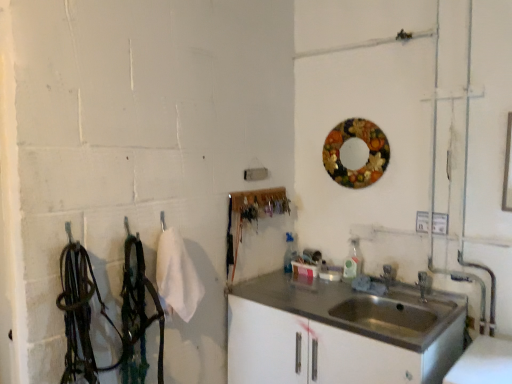
Question: Is point (371, 130) closer or farther from the camera than point (340, 347)?

Choices:
 (A) closer
 (B) farther

Answer: (B)

Question: Considering the positions of wooden circular mirror at upper right and satin white cabinet at lower right in the image, is wooden circular mirror at upper right taller or shorter than satin white cabinet at lower right?

Choices:
 (A) short
 (B) tall

Answer: (B)

Question: Estimate the real-world distances between objects in this image. Which object is closer to the satin silver faucet at sink right?

Choices:
 (A) satin white cabinet at lower right
 (B) wooden circular mirror at upper right

Answer: (A)

Question: Which object is positioned farthest from the satin white cabinet at lower right?

Choices:
 (A) satin silver faucet at sink right
 (B) wooden circular mirror at upper right

Answer: (B)